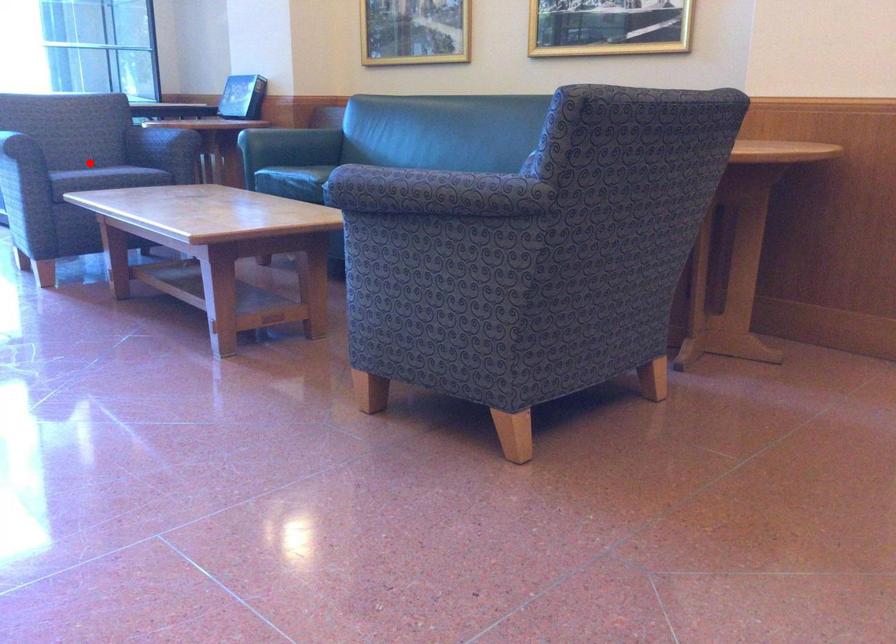
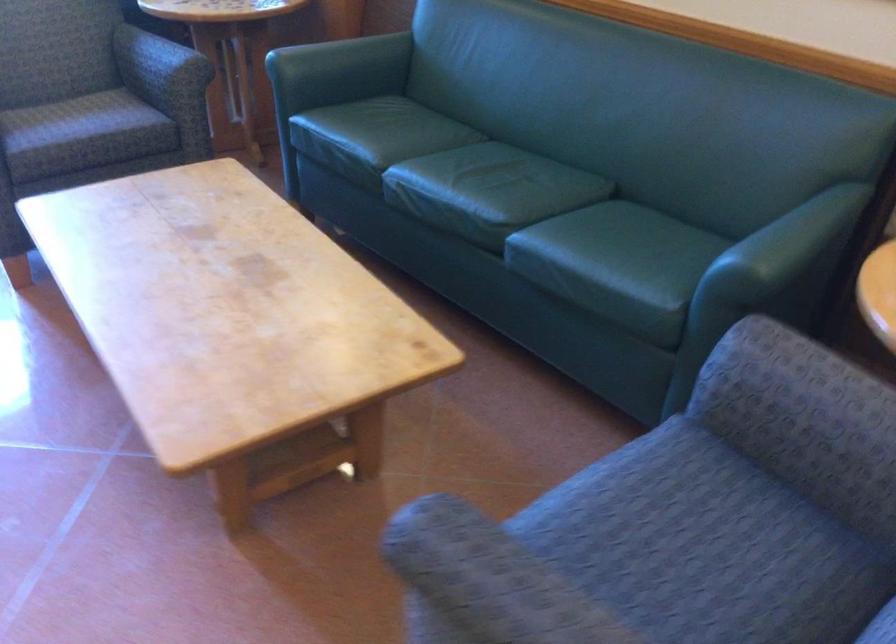
Where in the second image is the point corresponding to the highlighted location from the first image?

(65, 118)